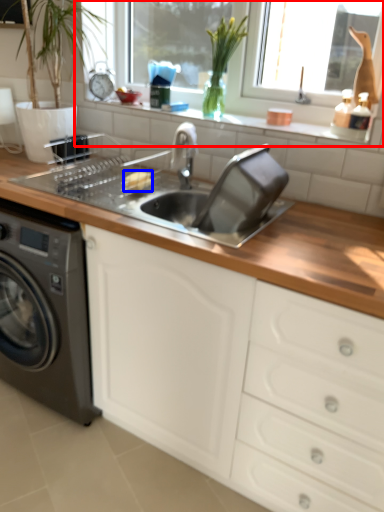
Question: Which point is further to the camera, window frame (highlighted by a red box) or food (highlighted by a blue box)?

Choices:
 (A) window frame
 (B) food

Answer: (B)